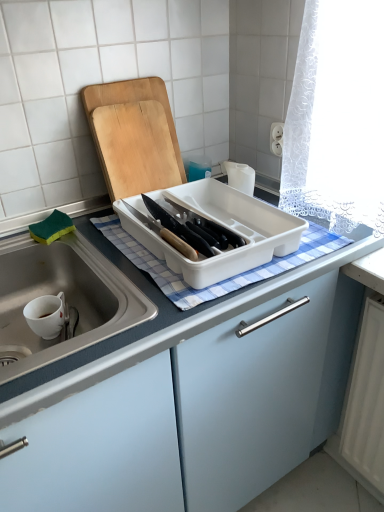
Question: From the image's perspective, would you say white plastic tray at center is shown under blue checkered cloth at center?

Choices:
 (A) yes
 (B) no

Answer: (B)

Question: Considering the relative sizes of white plastic tray at center and blue checkered cloth at center in the image provided, is white plastic tray at center bigger than blue checkered cloth at center?

Choices:
 (A) no
 (B) yes

Answer: (B)

Question: From the image's perspective, would you say white plastic tray at center is positioned over blue checkered cloth at center?

Choices:
 (A) no
 (B) yes

Answer: (B)

Question: Is white plastic tray at center wider than blue checkered cloth at center?

Choices:
 (A) yes
 (B) no

Answer: (B)

Question: Are white plastic tray at center and blue checkered cloth at center far apart?

Choices:
 (A) no
 (B) yes

Answer: (A)

Question: Is white plastic tray at center facing towards blue checkered cloth at center?

Choices:
 (A) yes
 (B) no

Answer: (B)

Question: From a real-world perspective, is wooden cutting board at upper center over white plastic tray at center?

Choices:
 (A) no
 (B) yes

Answer: (B)

Question: Is wooden cutting board at upper center wider than white plastic tray at center?

Choices:
 (A) yes
 (B) no

Answer: (B)

Question: Considering the relative positions of wooden cutting board at upper center and white plastic tray at center in the image provided, is wooden cutting board at upper center in front of white plastic tray at center?

Choices:
 (A) no
 (B) yes

Answer: (A)

Question: From the image's perspective, is wooden cutting board at upper center located beneath white plastic tray at center?

Choices:
 (A) yes
 (B) no

Answer: (B)

Question: Could you tell me if wooden cutting board at upper center is turned towards white plastic tray at center?

Choices:
 (A) yes
 (B) no

Answer: (A)

Question: Is wooden cutting board at upper center not within white plastic tray at center?

Choices:
 (A) no
 (B) yes

Answer: (B)

Question: Is white plastic tray at center positioned before wooden cutting board at upper center?

Choices:
 (A) no
 (B) yes

Answer: (B)